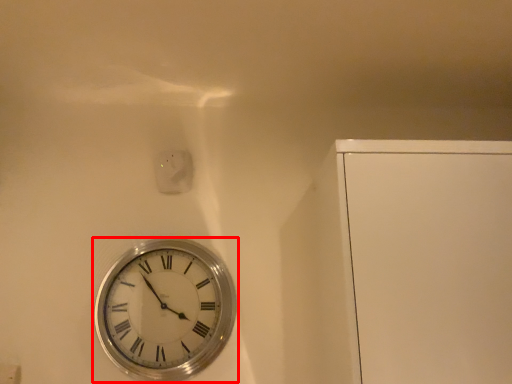
Question: In this image, where is wall clock (annotated by the red box) located relative to electric outlet?

Choices:
 (A) left
 (B) right

Answer: (B)